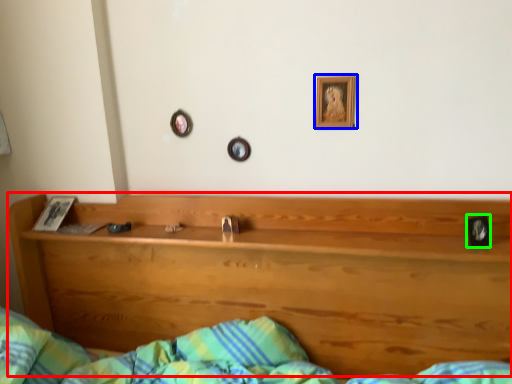
Question: Based on their relative distances, which object is nearer to bunk bed (highlighted by a red box)? Choose from picture frame (highlighted by a blue box) and picture frame (highlighted by a green box).

Choices:
 (A) picture frame
 (B) picture frame

Answer: (A)